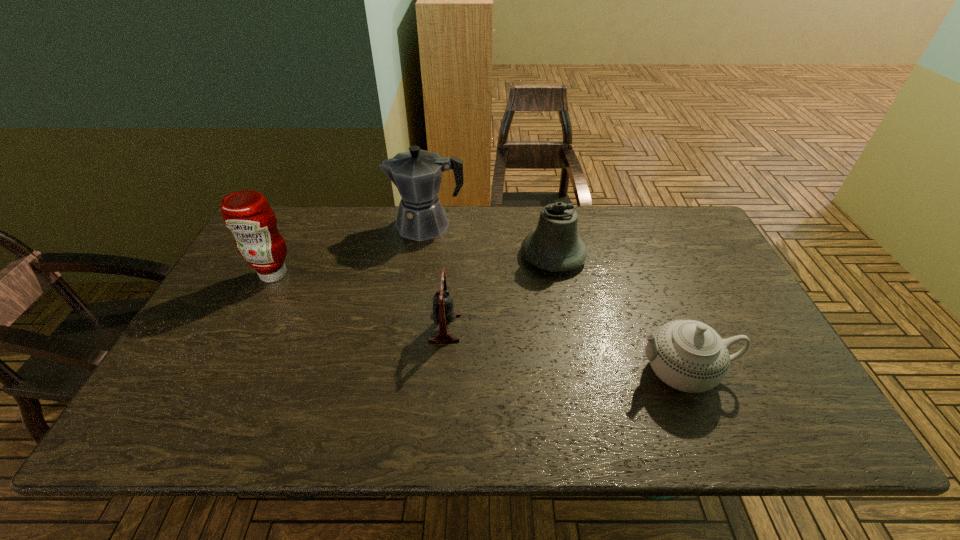
Locate an element on the screen. Image resolution: width=960 pixels, height=540 pixels. coffeepot is located at coordinates (417, 174).

This screenshot has height=540, width=960. I want to click on condiment, so click(x=246, y=213).

Find the location of `the farther bell`. the farther bell is located at coordinates (554, 246).

Where is `the right bell`? The image size is (960, 540). the right bell is located at coordinates (554, 246).

I want to click on the nearer bell, so click(x=443, y=312).

Find the location of a particular element. The height and width of the screenshot is (540, 960). chinaware is located at coordinates (688, 355).

The width and height of the screenshot is (960, 540). In order to click on blank space located 0.210m at the spout of the coffeepot in this screenshot , I will do `click(325, 225)`.

Where is `vacant space located at the spout of the coffeepot`? Image resolution: width=960 pixels, height=540 pixels. vacant space located at the spout of the coffeepot is located at coordinates (362, 225).

You are a GUI agent. You are given a task and a screenshot of the screen. Output one action in this format:
    pyautogui.click(x=<x>, y=<y>)
    Task: Click on the vacant space located at the spout of the coffeepot
    The width and height of the screenshot is (960, 540).
    Given the screenshot: What is the action you would take?
    pyautogui.click(x=347, y=225)

The height and width of the screenshot is (540, 960). Find the location of `free space located on the right of the condiment`. free space located on the right of the condiment is located at coordinates (393, 274).